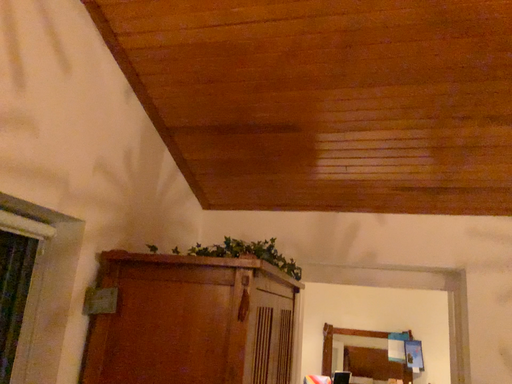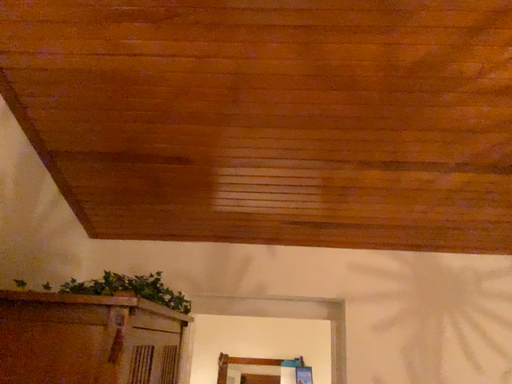
Question: Which way did the camera rotate in the video?

Choices:
 (A) rotated left
 (B) rotated right

Answer: (B)